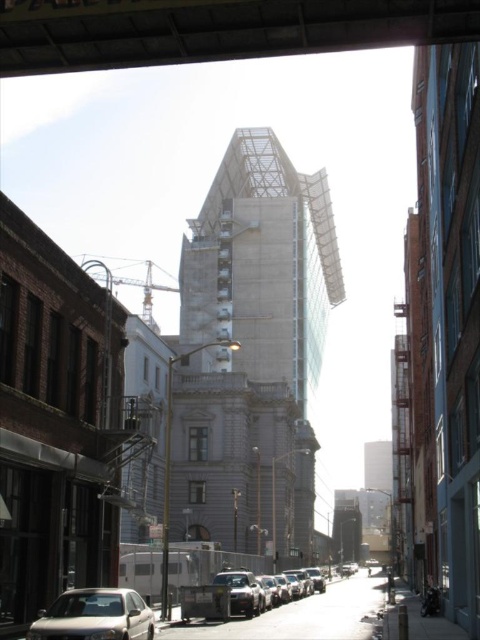
Question: Can you confirm if silver metallic sedan at lower left is positioned above metallic construction crane at left?

Choices:
 (A) no
 (B) yes

Answer: (A)

Question: Among these objects, which one is nearest to the camera?

Choices:
 (A) metal at upper center
 (B) silver metallic sedan at lower left

Answer: (A)

Question: Is silver metallic sedan at lower left positioned before metallic construction crane at left?

Choices:
 (A) no
 (B) yes

Answer: (B)

Question: Does silver metallic sedan at lower left lie behind metallic silver car at center?

Choices:
 (A) yes
 (B) no

Answer: (B)

Question: Which point appears closest to the camera in this image?

Choices:
 (A) (107, 4)
 (B) (230, 499)

Answer: (A)

Question: Which point appears farthest from the camera in this image?

Choices:
 (A) (212, 516)
 (B) (309, 588)
 (C) (148, 317)

Answer: (C)